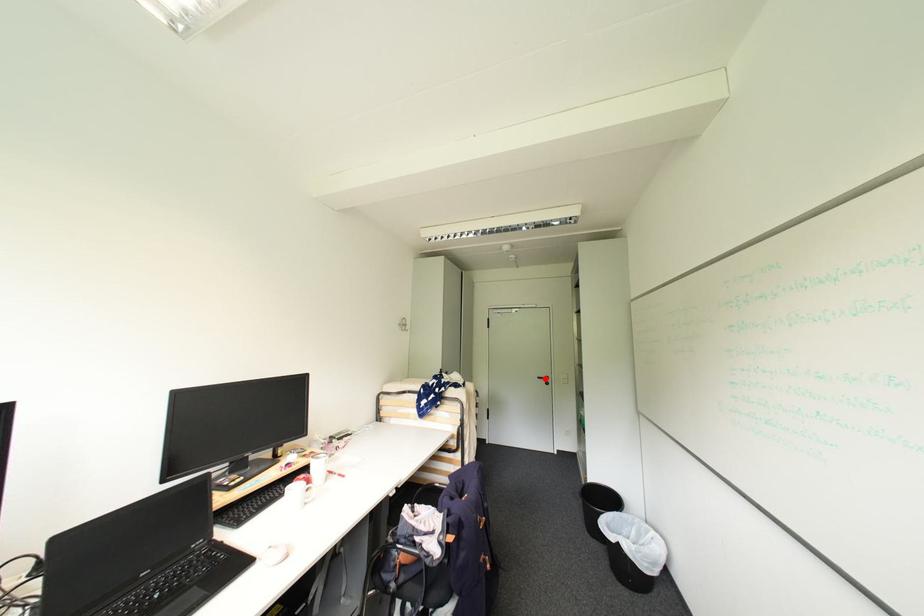
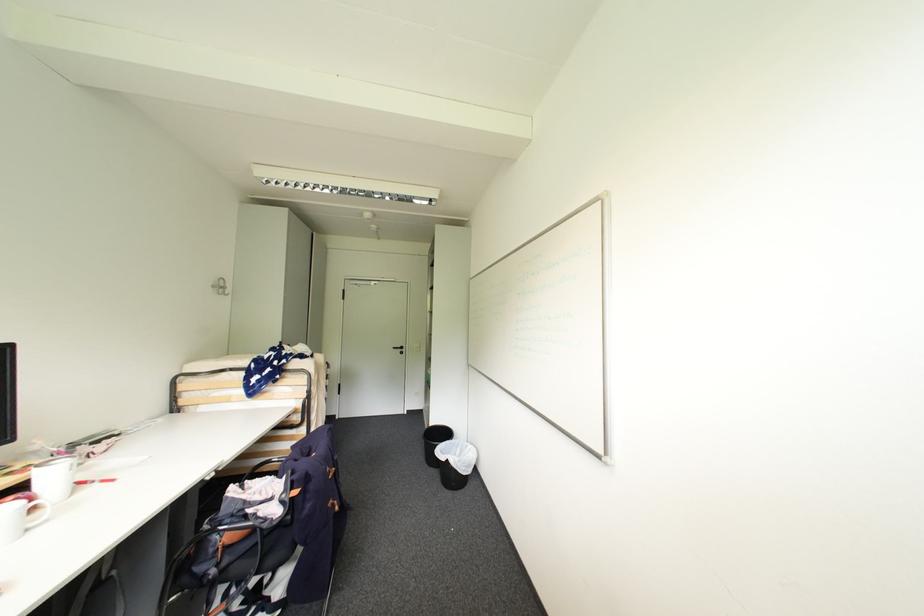
Question: I am providing you with two images of the same scene from different viewpoints. A red point is marked on the first image. Can you still see the location of the red point in image 2?

Choices:
 (A) Yes
 (B) No

Answer: (A)